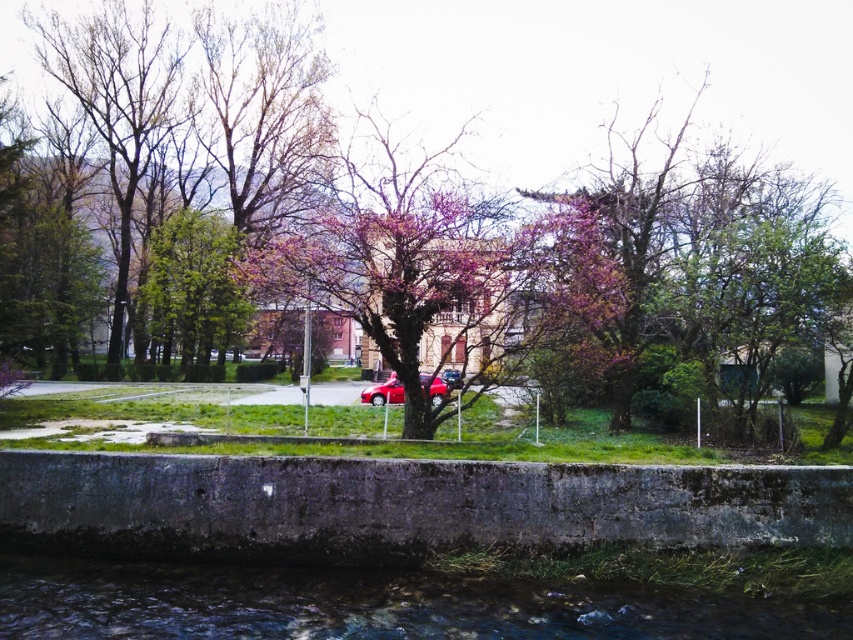
Question: Does purple-blooming tree at center appear on the right side of green leafy tree at center?

Choices:
 (A) no
 (B) yes

Answer: (B)

Question: Which of these objects is positioned closest to the clear water at lower center?

Choices:
 (A) green leafy tree at center
 (B) pink blossoming tree at center
 (C) purple bloom at center
 (D) purple-blooming tree at center

Answer: (B)

Question: Which object appears closest to the camera in this image?

Choices:
 (A) purple bloom at center
 (B) green leafy tree at center
 (C) pink blossoming tree at center

Answer: (C)

Question: Where is clear water at lower center located in relation to pink blossoming tree at center in the image?

Choices:
 (A) below
 (B) above

Answer: (A)

Question: Does pink blossoming tree at center come behind green leafy tree at center?

Choices:
 (A) no
 (B) yes

Answer: (A)

Question: Which point is closer to the camera?

Choices:
 (A) purple bloom at center
 (B) clear water at lower center
 (C) pink blossoming tree at center
 (D) purple-blooming tree at center

Answer: (B)